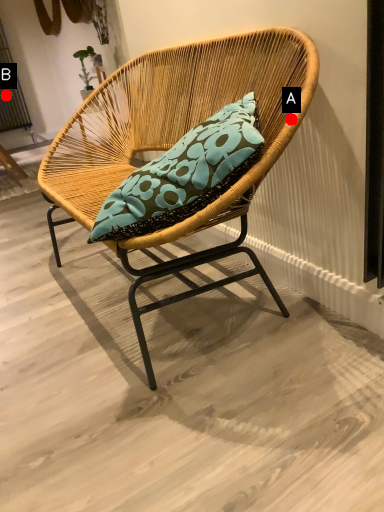
Question: Two points are circled on the image, labeled by A and B beside each circle. Which of the following is the closest to the observer?

Choices:
 (A) A is closer
 (B) B is closer

Answer: (A)